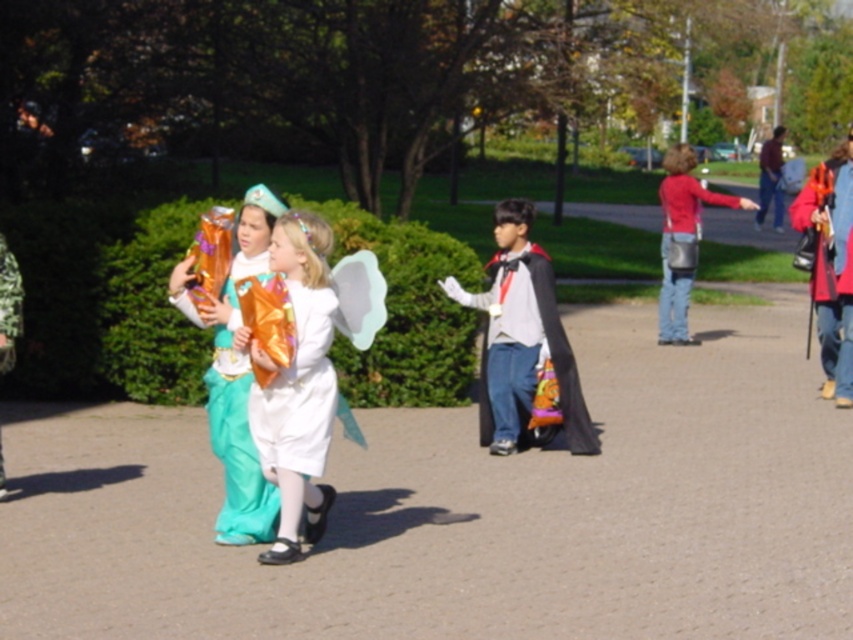
Is teal satin dress at center to the left of orange shiny umbrella at right from the viewer's perspective?

Correct, you'll find teal satin dress at center to the left of orange shiny umbrella at right.

Which is more to the left, teal satin dress at center or orange shiny umbrella at right?

Positioned to the left is teal satin dress at center.

Is point (247, 522) closer to viewer compared to point (811, 189)?

Yes, it is in front of point (811, 189).

The height and width of the screenshot is (640, 853). I want to click on teal satin dress at center, so click(236, 445).

Is teal satin dress at center below black matte cape at center?

Answer: Correct, teal satin dress at center is located below black matte cape at center.

Can you confirm if teal satin dress at center is wider than black matte cape at center?

Indeed, teal satin dress at center has a greater width compared to black matte cape at center.

Does point (218, 326) come farther from viewer compared to point (567, 355)?

No, (218, 326) is closer to viewer.

You are a GUI agent. You are given a task and a screenshot of the screen. Output one action in this format:
    pyautogui.click(x=<x>, y=<y>)
    Task: Click on the teal satin dress at center
    The image size is (853, 640).
    Given the screenshot: What is the action you would take?
    pyautogui.click(x=236, y=445)

Is smooth concrete path at center below shiny gold wings at center?

Yes, smooth concrete path at center is below shiny gold wings at center.

Can you confirm if smooth concrete path at center is shorter than shiny gold wings at center?

No, smooth concrete path at center is not shorter than shiny gold wings at center.

Between point (619, 472) and point (0, 337), which one is positioned behind?

The point (619, 472) is more distant.

In order to click on smooth concrete path at center in this screenshot , I will do `click(469, 508)`.